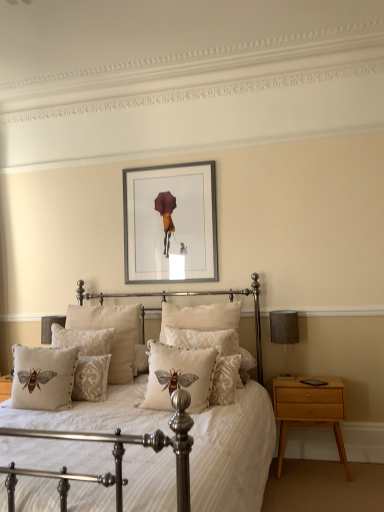
The height and width of the screenshot is (512, 384). I want to click on textured gray lampshade at right, so click(x=284, y=333).

At what (x,y) coordinates should I click in order to perform the action: click on beige damask pillow at center, positioned as the fifth pillow in front-to-back order. Please return your answer as a coordinate pair (x, y). This screenshot has height=512, width=384. Looking at the image, I should click on (83, 340).

Locate an element on the screen. beige embroidered cushion with bee design at center, acting as the second pillow starting from the front is located at coordinates point(43,378).

Locate an element on the screen. beige embroidered pillow with bee design at center, which is the sixth pillow from back to front is located at coordinates (182, 373).

Is beige damask pillow with bee design at center, which is counted as the 3th pillow, starting from the back, wider than light brown wood nightstand at right?

Yes, beige damask pillow with bee design at center, which is counted as the 3th pillow, starting from the back, is wider than light brown wood nightstand at right.

Is the depth of beige damask pillow with bee design at center, which is counted as the 3th pillow, starting from the back, greater than that of light brown wood nightstand at right?

No, beige damask pillow with bee design at center, which is counted as the 3th pillow, starting from the back, is closer to the camera.

Between beige damask pillow with bee design at center, positioned as the 4th pillow in front-to-back order, and light brown wood nightstand at right, which one appears on the left side from the viewer's perspective?

From the viewer's perspective, beige damask pillow with bee design at center, positioned as the 4th pillow in front-to-back order, appears more on the left side.

Does beige embroidered pillow with bee design at center, which ranks as the 1th pillow in front-to-back order, appear on the right side of beige damask pillow at center, positioned as the fifth pillow in front-to-back order?

Yes, beige embroidered pillow with bee design at center, which ranks as the 1th pillow in front-to-back order, is to the right of beige damask pillow at center, positioned as the fifth pillow in front-to-back order.

Is beige embroidered pillow with bee design at center, which is the sixth pillow from back to front, facing towards beige damask pillow at center, the 2th pillow in the back-to-front sequence?

No, beige embroidered pillow with bee design at center, which is the sixth pillow from back to front, does not turn towards beige damask pillow at center, the 2th pillow in the back-to-front sequence.

Does beige embroidered pillow with bee design at center, which is the sixth pillow from back to front, have a greater width compared to beige damask pillow at center, positioned as the fifth pillow in front-to-back order?

Correct, the width of beige embroidered pillow with bee design at center, which is the sixth pillow from back to front, exceeds that of beige damask pillow at center, positioned as the fifth pillow in front-to-back order.

What are the coordinates of `picture frame above the matte white bed at center (from a real-world perspective)` in the screenshot? It's located at (170, 223).

Is matte white bed at center surrounded by silver metallic picture frame at upper center?

No, matte white bed at center is not surrounded by silver metallic picture frame at upper center.

Is silver metallic picture frame at upper center aimed at matte white bed at center?

No, silver metallic picture frame at upper center is not aimed at matte white bed at center.

Which pillow is the 3rd one when counting from the front of the beige damask pillow at center, positioned as the fifth pillow in front-to-back order? Please provide its 2D coordinates.

[(43, 378)]

Is beige damask pillow at center, positioned as the fifth pillow in front-to-back order, facing away from beige embroidered cushion with bee design at center, acting as the second pillow starting from the front?

That's not correct — beige damask pillow at center, positioned as the fifth pillow in front-to-back order, is not looking away from beige embroidered cushion with bee design at center, acting as the second pillow starting from the front.

Considering the sizes of beige damask pillow at center, positioned as the fifth pillow in front-to-back order, and beige embroidered cushion with bee design at center, the 5th pillow positioned from the back, in the image, is beige damask pillow at center, positioned as the fifth pillow in front-to-back order, wider or thinner than beige embroidered cushion with bee design at center, the 5th pillow positioned from the back,?

Clearly, beige damask pillow at center, positioned as the fifth pillow in front-to-back order, has less width compared to beige embroidered cushion with bee design at center, the 5th pillow positioned from the back.

Is beige damask pillow at center, positioned as the fifth pillow in front-to-back order, located outside beige embroidered cushion with bee design at center, acting as the second pillow starting from the front?

beige damask pillow at center, positioned as the fifth pillow in front-to-back order, lies outside beige embroidered cushion with bee design at center, acting as the second pillow starting from the front,'s area.

Could you tell me if beige damask pillow at center, positioned as the fifth pillow in front-to-back order, is turned towards beige embroidered pillow with bee design at center, which is the sixth pillow from back to front?

No, beige damask pillow at center, positioned as the fifth pillow in front-to-back order, is not aimed at beige embroidered pillow with bee design at center, which is the sixth pillow from back to front.

Between beige damask pillow at center, positioned as the fifth pillow in front-to-back order, and beige embroidered pillow with bee design at center, which ranks as the 1th pillow in front-to-back order, which one has larger size?

beige embroidered pillow with bee design at center, which ranks as the 1th pillow in front-to-back order, is bigger.

Is beige damask pillow at center, positioned as the fifth pillow in front-to-back order, placed right next to beige embroidered pillow with bee design at center, which ranks as the 1th pillow in front-to-back order?

No, beige damask pillow at center, positioned as the fifth pillow in front-to-back order, is not beside beige embroidered pillow with bee design at center, which ranks as the 1th pillow in front-to-back order.

From the image's perspective, which pillow is the 1st one below the beige embroidered pillow with bee design at center, which ranks as the 1th pillow in front-to-back order? Please provide its 2D coordinates.

[(83, 340)]

From a real-world perspective, between beige damask pillow at center, positioned as the fifth pillow in front-to-back order, and white textured pillow with bee design at center, arranged as the 4th pillow when viewed from the back, who is vertically lower?

white textured pillow with bee design at center, arranged as the 4th pillow when viewed from the back, from a real-world perspective.

From the picture: Which object is thinner, beige damask pillow at center, the 2th pillow in the back-to-front sequence, or white textured pillow with bee design at center, the 3th pillow viewed from the front?

With smaller width is white textured pillow with bee design at center, the 3th pillow viewed from the front.

From the image's perspective, relative to white textured pillow with bee design at center, arranged as the 4th pillow when viewed from the back, is beige damask pillow at center, the 2th pillow in the back-to-front sequence, above or below?

Clearly, from the image's perspective, beige damask pillow at center, the 2th pillow in the back-to-front sequence, is below white textured pillow with bee design at center, arranged as the 4th pillow when viewed from the back.

Is beige damask pillow at center, positioned as the fifth pillow in front-to-back order, with white textured pillow with bee design at center, the 3th pillow viewed from the front?

No, beige damask pillow at center, positioned as the fifth pillow in front-to-back order, is not making contact with white textured pillow with bee design at center, the 3th pillow viewed from the front.

Considering the sizes of objects silver metallic picture frame at upper center and white textured pillow with bee design at center, the 3th pillow viewed from the front, in the image provided, who is shorter, silver metallic picture frame at upper center or white textured pillow with bee design at center, the 3th pillow viewed from the front,?

With less height is white textured pillow with bee design at center, the 3th pillow viewed from the front.

Would you say silver metallic picture frame at upper center is a long distance from white textured pillow with bee design at center, arranged as the 4th pillow when viewed from the back?

No, there isn't a large distance between silver metallic picture frame at upper center and white textured pillow with bee design at center, arranged as the 4th pillow when viewed from the back.

Who is smaller, silver metallic picture frame at upper center or white textured pillow with bee design at center, arranged as the 4th pillow when viewed from the back?

Smaller between the two is white textured pillow with bee design at center, arranged as the 4th pillow when viewed from the back.

Consider the image. Can you tell me how much silver metallic picture frame at upper center and white textured pillow with bee design at center, the 3th pillow viewed from the front, differ in facing direction?

There is a 2.92-degree angle between the facing directions of silver metallic picture frame at upper center and white textured pillow with bee design at center, the 3th pillow viewed from the front.

In order to click on pillow that is the 1st one when counting leftward from the light brown wood nightstand at right in this screenshot , I will do `click(205, 328)`.

Locate an element on the screen. Image resolution: width=384 pixels, height=512 pixels. pillow that is the 1st one when counting upward from the beige damask pillow at center, the 2th pillow in the back-to-front sequence (from the image's perspective) is located at coordinates (182, 373).

Based on their spatial positions, is silver metallic picture frame at upper center or beige damask pillow at center, the 6th pillow from the front, closer to beige embroidered pillow with bee design at center, which is the sixth pillow from back to front?

Based on the image, beige damask pillow at center, the 6th pillow from the front, appears to be nearer to beige embroidered pillow with bee design at center, which is the sixth pillow from back to front.

When comparing their distances from beige embroidered cushion with bee design at center, the 5th pillow positioned from the back, does beige damask pillow at center, positioned as the fifth pillow in front-to-back order, or silver metallic picture frame at upper center seem further?

silver metallic picture frame at upper center is further to beige embroidered cushion with bee design at center, the 5th pillow positioned from the back.

Looking at the image, which one is located closer to white textured pillow with bee design at center, the 3th pillow viewed from the front, beige damask pillow at center, the 2th pillow in the back-to-front sequence, or matte white bed at center?

The object closer to white textured pillow with bee design at center, the 3th pillow viewed from the front, is matte white bed at center.

Looking at the image, which one is located closer to beige damask pillow at center, the 6th pillow from the front, silver metallic picture frame at upper center or light brown wood nightstand at right?

Based on the image, silver metallic picture frame at upper center appears to be nearer to beige damask pillow at center, the 6th pillow from the front.

Based on the photo, estimate the real-world distances between objects in this image. Which object is closer to textured gray lampshade at right, silver metallic picture frame at upper center or beige damask pillow with bee design at center, positioned as the 4th pillow in front-to-back order?

beige damask pillow with bee design at center, positioned as the 4th pillow in front-to-back order.

Based on their spatial positions, is beige damask pillow at center, the 6th pillow from the front, or light brown wood nightstand at right further from silver metallic picture frame at upper center?

light brown wood nightstand at right is positioned further to the anchor silver metallic picture frame at upper center.

Which object lies nearer to the anchor point beige damask pillow with bee design at center, positioned as the 4th pillow in front-to-back order, beige damask pillow at center, the 6th pillow from the front, or beige damask pillow at center, the 2th pillow in the back-to-front sequence?

beige damask pillow at center, the 6th pillow from the front, is closer to beige damask pillow with bee design at center, positioned as the 4th pillow in front-to-back order.

From the image, which object appears to be farther from silver metallic picture frame at upper center, beige damask pillow at center, the 6th pillow from the front, or beige embroidered cushion with bee design at center, the 5th pillow positioned from the back?

beige embroidered cushion with bee design at center, the 5th pillow positioned from the back, is positioned further to the anchor silver metallic picture frame at upper center.

I want to click on table lamp located between beige embroidered pillow with bee design at center, which ranks as the 1th pillow in front-to-back order, and light brown wood nightstand at right in the left-right direction, so tap(284, 333).

At what (x,y) coordinates should I click in order to perform the action: click on table lamp located between white textured pillow with bee design at center, arranged as the 4th pillow when viewed from the back, and light brown wood nightstand at right in the left-right direction. Please return your answer as a coordinate pair (x, y). The width and height of the screenshot is (384, 512). Looking at the image, I should click on (284, 333).

Identify the location of pillow between white textured pillow with bee design at center, the 3th pillow viewed from the front, and light brown wood nightstand at right. This screenshot has height=512, width=384. (205, 328).

The image size is (384, 512). Find the location of `picture frame between beige embroidered cushion with bee design at center, the 5th pillow positioned from the back, and light brown wood nightstand at right`. picture frame between beige embroidered cushion with bee design at center, the 5th pillow positioned from the back, and light brown wood nightstand at right is located at coordinates (170, 223).